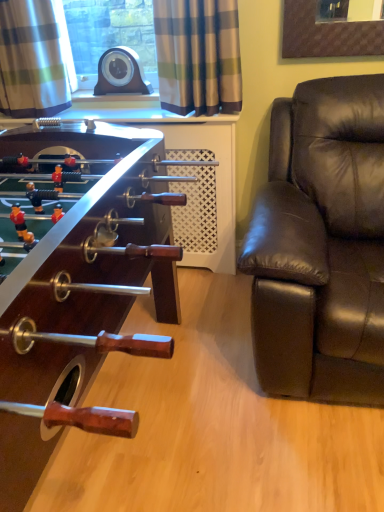
Describe the element at coordinates (31, 60) in the screenshot. I see `plaid fabric curtain at upper left, placed as the 1th curtain when sorted from left to right` at that location.

At what (x,y) coordinates should I click in order to perform the action: click on plaid fabric curtain at upper center, the first curtain viewed from the right. Please return your answer as a coordinate pair (x, y). Looking at the image, I should click on (198, 55).

Looking at the image, does plaid fabric curtain at upper left, the second curtain in the right-to-left sequence, seem bigger or smaller compared to plaid fabric curtain at upper center, marked as the 2th curtain in a left-to-right arrangement?

In the image, plaid fabric curtain at upper left, the second curtain in the right-to-left sequence, appears to be larger than plaid fabric curtain at upper center, marked as the 2th curtain in a left-to-right arrangement.

How different are the orientations of plaid fabric curtain at upper left, placed as the 1th curtain when sorted from left to right, and plaid fabric curtain at upper center, marked as the 2th curtain in a left-to-right arrangement, in degrees?

The angle between the facing direction of plaid fabric curtain at upper left, placed as the 1th curtain when sorted from left to right, and the facing direction of plaid fabric curtain at upper center, marked as the 2th curtain in a left-to-right arrangement, is 2.56 degrees.

In terms of height, does plaid fabric curtain at upper left, placed as the 1th curtain when sorted from left to right, look taller or shorter compared to plaid fabric curtain at upper center, the first curtain viewed from the right?

Clearly, plaid fabric curtain at upper left, placed as the 1th curtain when sorted from left to right, is taller compared to plaid fabric curtain at upper center, the first curtain viewed from the right.

Is plaid fabric curtain at upper left, placed as the 1th curtain when sorted from left to right, at the left side of plaid fabric curtain at upper center, marked as the 2th curtain in a left-to-right arrangement?

Yes, plaid fabric curtain at upper left, placed as the 1th curtain when sorted from left to right, is to the left of plaid fabric curtain at upper center, marked as the 2th curtain in a left-to-right arrangement.

Between wooden foosball table at left and brown leather couch at right, which one has smaller width?

With smaller width is brown leather couch at right.

Is wooden foosball table at left directly adjacent to brown leather couch at right?

No, wooden foosball table at left is not in contact with brown leather couch at right.

Can you confirm if wooden foosball table at left is positioned to the left of brown leather couch at right?

Indeed, wooden foosball table at left is positioned on the left side of brown leather couch at right.

Locate an element on the screen. table that is in front of the plaid fabric curtain at upper center, the first curtain viewed from the right is located at coordinates (82, 256).

Is plaid fabric curtain at upper center, the first curtain viewed from the right, situated inside wooden foosball table at left or outside?

plaid fabric curtain at upper center, the first curtain viewed from the right, is not inside wooden foosball table at left, it's outside.

From the picture: Based on their sizes in the image, would you say plaid fabric curtain at upper center, the first curtain viewed from the right, is bigger or smaller than wooden foosball table at left?

In the image, plaid fabric curtain at upper center, the first curtain viewed from the right, appears to be smaller than wooden foosball table at left.

How much distance is there between plaid fabric curtain at upper center, the first curtain viewed from the right, and wooden foosball table at left?

plaid fabric curtain at upper center, the first curtain viewed from the right, and wooden foosball table at left are 25.81 inches apart from each other.

From a real-world perspective, is plaid fabric curtain at upper center, the first curtain viewed from the right, positioned over brown leather couch at right based on gravity?

Yes, from a real-world perspective, plaid fabric curtain at upper center, the first curtain viewed from the right, is over brown leather couch at right

Is plaid fabric curtain at upper center, marked as the 2th curtain in a left-to-right arrangement, turned away from brown leather couch at right?

No, plaid fabric curtain at upper center, marked as the 2th curtain in a left-to-right arrangement,'s orientation is not away from brown leather couch at right.

Consider the image. Is plaid fabric curtain at upper center, marked as the 2th curtain in a left-to-right arrangement, surrounding brown leather couch at right?

No, brown leather couch at right is not surrounded by plaid fabric curtain at upper center, marked as the 2th curtain in a left-to-right arrangement.

From the image's perspective, is plaid fabric curtain at upper center, marked as the 2th curtain in a left-to-right arrangement, located beneath brown leather couch at right?

No, from the image's perspective, plaid fabric curtain at upper center, marked as the 2th curtain in a left-to-right arrangement, is not below brown leather couch at right.

Is brown leather couch at right wider or thinner than plaid fabric curtain at upper center, marked as the 2th curtain in a left-to-right arrangement?

Clearly, brown leather couch at right has more width compared to plaid fabric curtain at upper center, marked as the 2th curtain in a left-to-right arrangement.

Is brown leather couch at right inside the boundaries of plaid fabric curtain at upper center, the first curtain viewed from the right, or outside?

brown leather couch at right exists outside the volume of plaid fabric curtain at upper center, the first curtain viewed from the right.

From the image's perspective, between brown leather couch at right and plaid fabric curtain at upper center, marked as the 2th curtain in a left-to-right arrangement, which one is located above?

plaid fabric curtain at upper center, marked as the 2th curtain in a left-to-right arrangement, appears higher in the image.

Does brown leather couch at right appear on the right side of plaid fabric curtain at upper center, the first curtain viewed from the right?

Yes, brown leather couch at right is to the right of plaid fabric curtain at upper center, the first curtain viewed from the right.

Considering the sizes of objects plaid fabric curtain at upper left, the second curtain in the right-to-left sequence, and brown leather couch at right in the image provided, who is bigger, plaid fabric curtain at upper left, the second curtain in the right-to-left sequence, or brown leather couch at right?

Bigger between the two is brown leather couch at right.

From the image's perspective, which one is positioned lower, plaid fabric curtain at upper left, the second curtain in the right-to-left sequence, or brown leather couch at right?

From the image's view, brown leather couch at right is below.

Is plaid fabric curtain at upper left, the second curtain in the right-to-left sequence, closer to camera compared to brown leather couch at right?

No, it is not.

From a real-world perspective, is plaid fabric curtain at upper left, placed as the 1th curtain when sorted from left to right, beneath brown leather couch at right?

No, from a real-world perspective, plaid fabric curtain at upper left, placed as the 1th curtain when sorted from left to right, is not below brown leather couch at right.

Measure the distance between plaid fabric curtain at upper left, the second curtain in the right-to-left sequence, and wooden foosball table at left.

A distance of 75.06 centimeters exists between plaid fabric curtain at upper left, the second curtain in the right-to-left sequence, and wooden foosball table at left.

Are plaid fabric curtain at upper left, placed as the 1th curtain when sorted from left to right, and wooden foosball table at left beside each other?

No, plaid fabric curtain at upper left, placed as the 1th curtain when sorted from left to right, is not in contact with wooden foosball table at left.

Is plaid fabric curtain at upper left, placed as the 1th curtain when sorted from left to right, facing towards wooden foosball table at left?

Yes, plaid fabric curtain at upper left, placed as the 1th curtain when sorted from left to right, faces towards wooden foosball table at left.

Is plaid fabric curtain at upper left, placed as the 1th curtain when sorted from left to right, at the left side of wooden foosball table at left?

Correct, you'll find plaid fabric curtain at upper left, placed as the 1th curtain when sorted from left to right, to the left of wooden foosball table at left.

Locate an element on the screen. curtain on the left of the plaid fabric curtain at upper center, marked as the 2th curtain in a left-to-right arrangement is located at coordinates (31, 60).

Where is `studio couch lying on the right of wooden foosball table at left`? This screenshot has width=384, height=512. studio couch lying on the right of wooden foosball table at left is located at coordinates (321, 245).

Which object lies nearer to the anchor point plaid fabric curtain at upper center, the first curtain viewed from the right, brown leather couch at right or plaid fabric curtain at upper left, placed as the 1th curtain when sorted from left to right?

brown leather couch at right lies closer to plaid fabric curtain at upper center, the first curtain viewed from the right, than the other object.

Estimate the real-world distances between objects in this image. Which object is closer to brown leather couch at right, wooden foosball table at left or plaid fabric curtain at upper left, placed as the 1th curtain when sorted from left to right?

wooden foosball table at left is closer to brown leather couch at right.

When comparing their distances from plaid fabric curtain at upper left, the second curtain in the right-to-left sequence, does wooden foosball table at left or plaid fabric curtain at upper center, marked as the 2th curtain in a left-to-right arrangement, seem further?

Based on the image, wooden foosball table at left appears to be further to plaid fabric curtain at upper left, the second curtain in the right-to-left sequence.

Which object lies nearer to the anchor point plaid fabric curtain at upper left, the second curtain in the right-to-left sequence, brown leather couch at right or wooden foosball table at left?

wooden foosball table at left is closer to plaid fabric curtain at upper left, the second curtain in the right-to-left sequence.

Considering their positions, is plaid fabric curtain at upper center, the first curtain viewed from the right, positioned further to brown leather couch at right than wooden foosball table at left?

The object further to brown leather couch at right is wooden foosball table at left.

Looking at the image, which one is located further to plaid fabric curtain at upper left, placed as the 1th curtain when sorted from left to right, wooden foosball table at left or brown leather couch at right?

brown leather couch at right lies further to plaid fabric curtain at upper left, placed as the 1th curtain when sorted from left to right, than the other object.

When comparing their distances from brown leather couch at right, does plaid fabric curtain at upper left, placed as the 1th curtain when sorted from left to right, or wooden foosball table at left seem further?

plaid fabric curtain at upper left, placed as the 1th curtain when sorted from left to right, is further to brown leather couch at right.

Estimate the real-world distances between objects in this image. Which object is closer to wooden foosball table at left, plaid fabric curtain at upper left, placed as the 1th curtain when sorted from left to right, or brown leather couch at right?

brown leather couch at right is positioned closer to the anchor wooden foosball table at left.

The width and height of the screenshot is (384, 512). I want to click on studio couch between wooden foosball table at left and plaid fabric curtain at upper center, the first curtain viewed from the right, from front to back, so click(x=321, y=245).

This screenshot has height=512, width=384. I want to click on curtain located between wooden foosball table at left and plaid fabric curtain at upper left, placed as the 1th curtain when sorted from left to right, in the depth direction, so click(x=198, y=55).

You are a GUI agent. You are given a task and a screenshot of the screen. Output one action in this format:
    pyautogui.click(x=<x>, y=<y>)
    Task: Click on the curtain between plaid fabric curtain at upper left, placed as the 1th curtain when sorted from left to right, and brown leather couch at right from left to right
    The image size is (384, 512).
    Given the screenshot: What is the action you would take?
    pyautogui.click(x=198, y=55)

Identify the location of table between plaid fabric curtain at upper left, placed as the 1th curtain when sorted from left to right, and brown leather couch at right. The height and width of the screenshot is (512, 384). (82, 256).